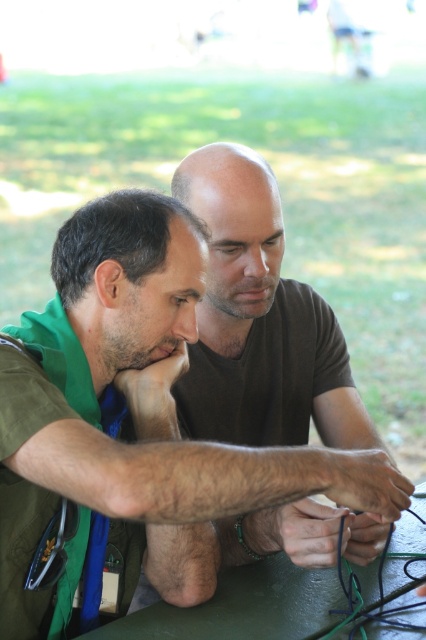
Question: Which of the following is the closest to the observer?

Choices:
 (A) (77, 637)
 (B) (141, 465)

Answer: (B)

Question: Is green fabric shirt at center wider than green matte table at center?

Choices:
 (A) no
 (B) yes

Answer: (A)

Question: Is green fabric shirt at center behind green matte table at center?

Choices:
 (A) no
 (B) yes

Answer: (A)

Question: Which point is closer to the camera?

Choices:
 (A) green fabric shirt at center
 (B) green matte table at center

Answer: (A)

Question: Does green fabric shirt at center appear over green matte table at center?

Choices:
 (A) yes
 (B) no

Answer: (A)